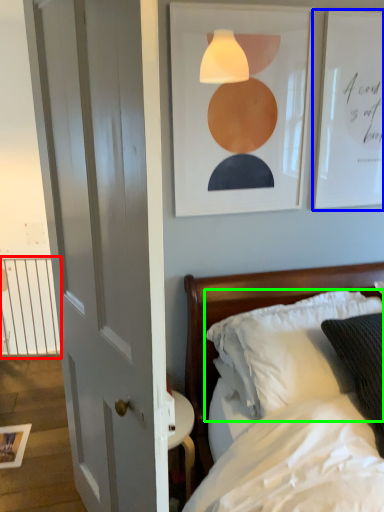
Question: Which object is positioned farthest from balustrade (highlighted by a red box)? Select from picture frame (highlighted by a blue box) and pillow (highlighted by a green box).

Choices:
 (A) picture frame
 (B) pillow

Answer: (A)